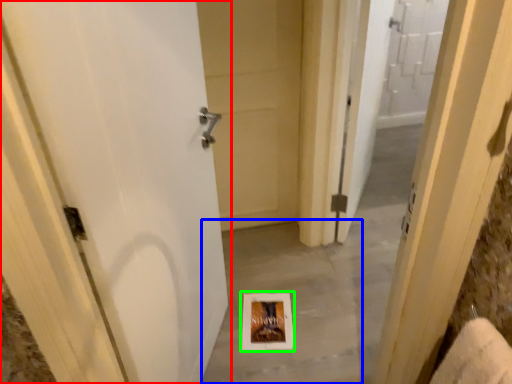
Question: Estimate the real-world distances between objects in this image. Which object is farther from door (highlighted by a red box), concrete (highlighted by a blue box) or picture frame (highlighted by a green box)?

Choices:
 (A) concrete
 (B) picture frame

Answer: (B)